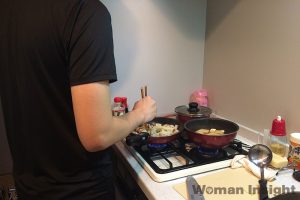
Where is `skillet`? skillet is located at coordinates (162, 137).